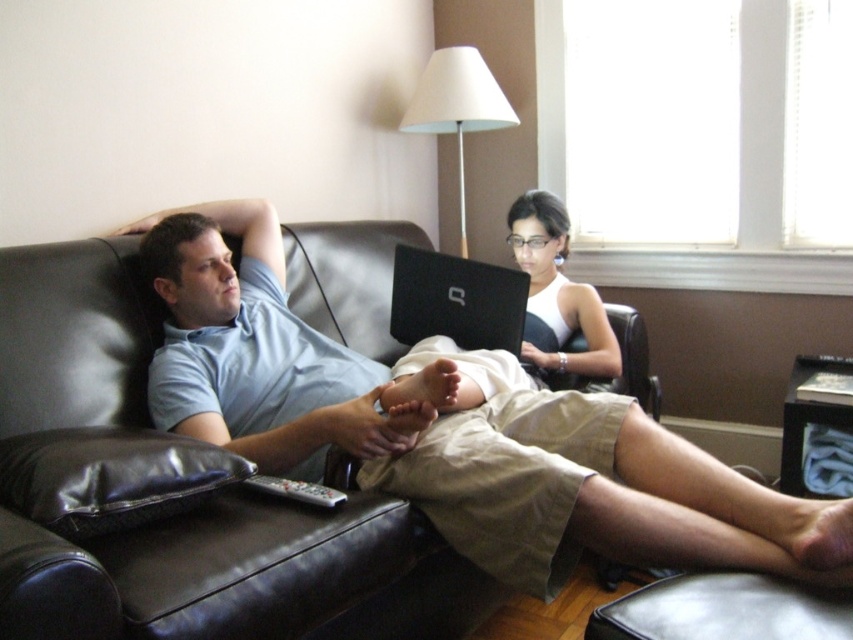
Question: Which point is closer to the camera taking this photo?

Choices:
 (A) (254, 486)
 (B) (489, 269)
 (C) (585, 340)

Answer: (A)

Question: Which of the following is the farthest from the observer?

Choices:
 (A) (279, 496)
 (B) (433, 332)
 (C) (544, 352)

Answer: (C)

Question: Based on their relative distances, which object is farther from the black matte laptop at center?

Choices:
 (A) gray plastic remote at lower center
 (B) white glossy tank top at center
 (C) light blue cotton shirt at center

Answer: (A)

Question: Can you confirm if black matte laptop at center is bigger than white glossy tank top at center?

Choices:
 (A) no
 (B) yes

Answer: (A)

Question: Is black matte laptop at center wider than white glossy tank top at center?

Choices:
 (A) no
 (B) yes

Answer: (B)

Question: Where is light blue cotton shirt at center located in relation to gray plastic remote at lower center in the image?

Choices:
 (A) below
 (B) above

Answer: (B)